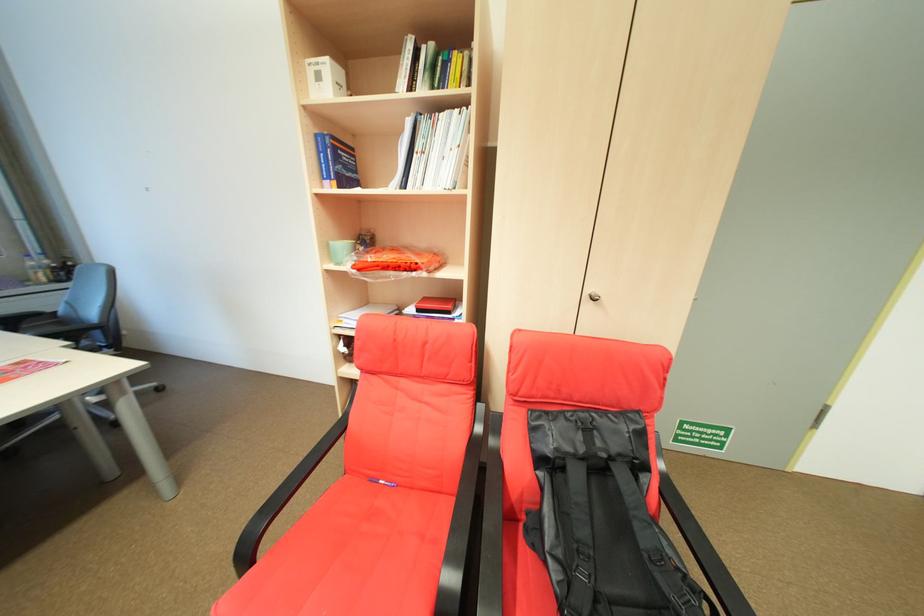
This screenshot has width=924, height=616. I want to click on silver cabinet knob, so click(593, 296).